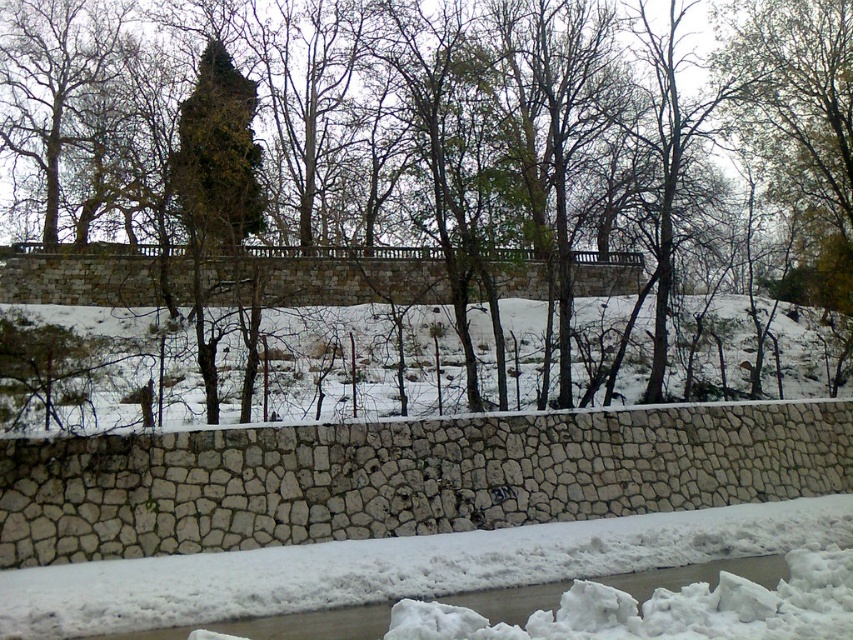
Does green leafy tree at upper center lie behind white fluffy snow at lower center?

Yes, green leafy tree at upper center is further from the viewer.

Which is in front, point (224, 243) or point (25, 588)?

Positioned in front is point (25, 588).

At what (x,y) coordinates should I click in order to perform the action: click on green leafy tree at upper center. Please return your answer as a coordinate pair (x, y). Looking at the image, I should click on (437, 172).

Does white fluffy snow at lower center appear under green mossy tree at upper center?

Correct, white fluffy snow at lower center is located below green mossy tree at upper center.

Based on the photo, is white fluffy snow at lower center wider than green mossy tree at upper center?

Indeed, white fluffy snow at lower center has a greater width compared to green mossy tree at upper center.

Is point (604, 544) positioned behind point (88, 61)?

No, it is not.

At what (x,y) coordinates should I click in order to perform the action: click on white fluffy snow at lower center. Please return your answer as a coordinate pair (x, y). Looking at the image, I should click on (380, 561).

Between green leafy tree at upper center and green mossy tree at upper center, which one appears on the left side from the viewer's perspective?

Positioned to the left is green mossy tree at upper center.

Which is more to the right, green leafy tree at upper center or green mossy tree at upper center?

From the viewer's perspective, green leafy tree at upper center appears more on the right side.

Between point (691, 266) and point (100, 179), which one is positioned in front?

Point (691, 266) is in front.

At what (x,y) coordinates should I click in order to perform the action: click on green leafy tree at upper center. Please return your answer as a coordinate pair (x, y). The image size is (853, 640). Looking at the image, I should click on (437, 172).